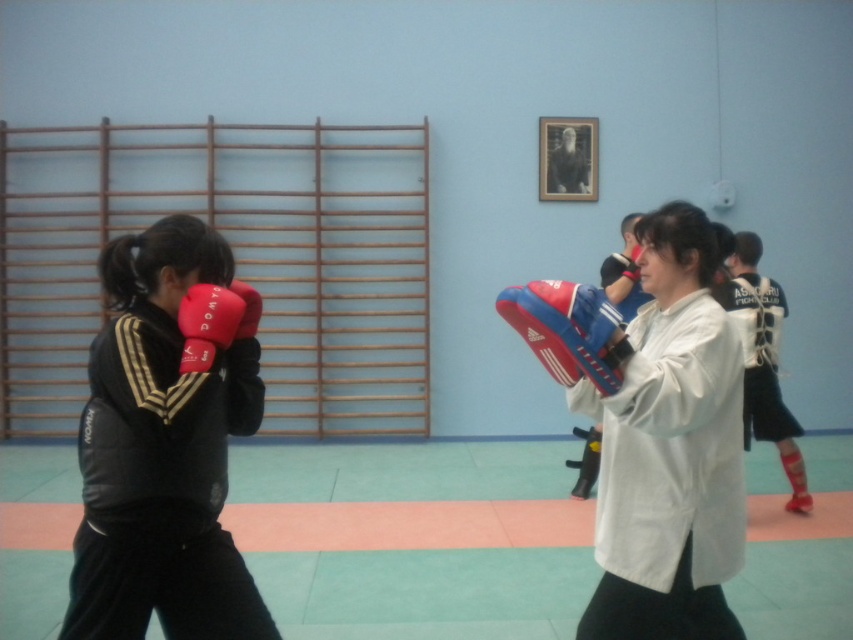
Between matte black jacket at left and red leather boxing glove at left, which one appears on the right side from the viewer's perspective?

red leather boxing glove at left is more to the right.

Who is more distant from viewer, (115, 276) or (218, 308)?

Point (115, 276)

Find the location of a particular element. The image size is (853, 640). matte black jacket at left is located at coordinates (161, 452).

Does matte black jacket at left have a greater width compared to red leather boxing glove at center?

Yes.

Does matte black jacket at left appear on the right side of red leather boxing glove at center?

In fact, matte black jacket at left is to the left of red leather boxing glove at center.

Does point (199, 372) lie behind point (606, 358)?

Yes.

Image resolution: width=853 pixels, height=640 pixels. I want to click on matte black jacket at left, so click(161, 452).

Can you confirm if matte black jacket at left is positioned below matte red boxing glove at left?

Correct, matte black jacket at left is located below matte red boxing glove at left.

Which is more to the left, matte black jacket at left or matte red boxing glove at left?

matte black jacket at left

What are the coordinates of `matte black jacket at left` in the screenshot? It's located at (161, 452).